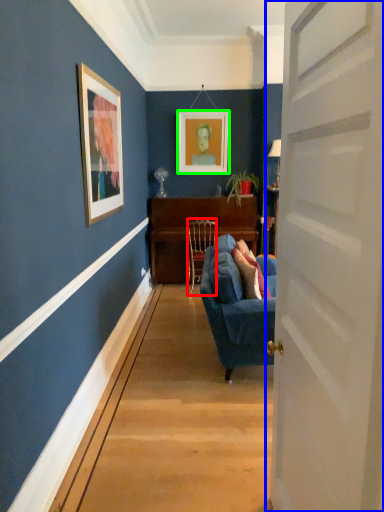
Question: Which object is positioned farthest from chair (highlighted by a red box)? Select from door (highlighted by a blue box) and picture frame (highlighted by a green box).

Choices:
 (A) door
 (B) picture frame

Answer: (A)